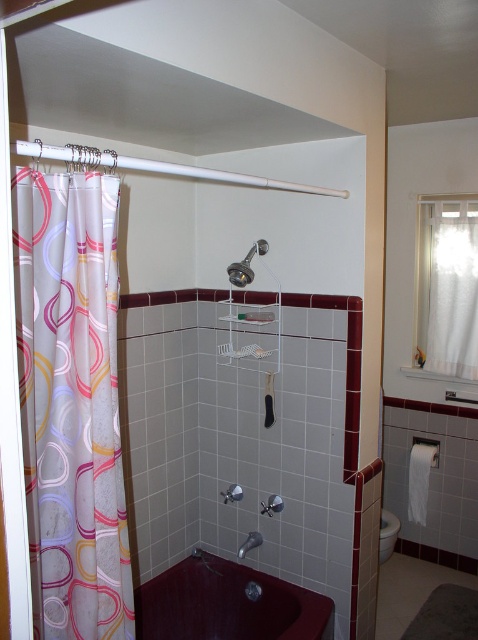
Question: Does maroon glossy bathtub at lower center have a smaller size compared to white sheer curtain at upper right?

Choices:
 (A) yes
 (B) no

Answer: (B)

Question: Can you confirm if maroon glossy bathtub at lower center is positioned above white sheer curtain at upper right?

Choices:
 (A) yes
 (B) no

Answer: (B)

Question: Considering the real-world distances, which object is closest to the white plastic shower curtain at left?

Choices:
 (A) maroon glossy bathtub at lower center
 (B) metallic silver towel bar at center
 (C) metallic chrome shower head at upper center

Answer: (C)

Question: Which is nearer to the white plastic shower curtain at left?

Choices:
 (A) metallic silver towel bar at center
 (B) metallic chrome shower head at upper center

Answer: (B)

Question: Which object is the farthest from the translucent fabric shower curtain at left?

Choices:
 (A) white plastic shower curtain at left
 (B) metallic chrome shower head at upper center

Answer: (B)

Question: Can you confirm if maroon glossy bathtub at lower center is smaller than white plastic shower curtain at left?

Choices:
 (A) yes
 (B) no

Answer: (B)